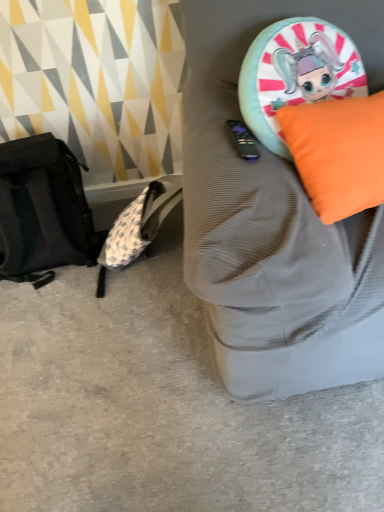
Question: Considering the positions of point (256, 300) and point (170, 340), is point (256, 300) closer or farther from the camera than point (170, 340)?

Choices:
 (A) farther
 (B) closer

Answer: (B)

Question: From a real-world perspective, is orange fabric cushion at upper right positioned above or below black fabric backpack at left?

Choices:
 (A) below
 (B) above

Answer: (B)

Question: Which object is positioned closest to the orange fabric pillow at upper right?

Choices:
 (A) black fabric backpack at left
 (B) black fabric messenger bag at left
 (C) orange fabric cushion at upper right

Answer: (C)

Question: Which is farther from the orange fabric pillow at upper right?

Choices:
 (A) black fabric messenger bag at left
 (B) black fabric backpack at left
 (C) orange fabric cushion at upper right

Answer: (A)